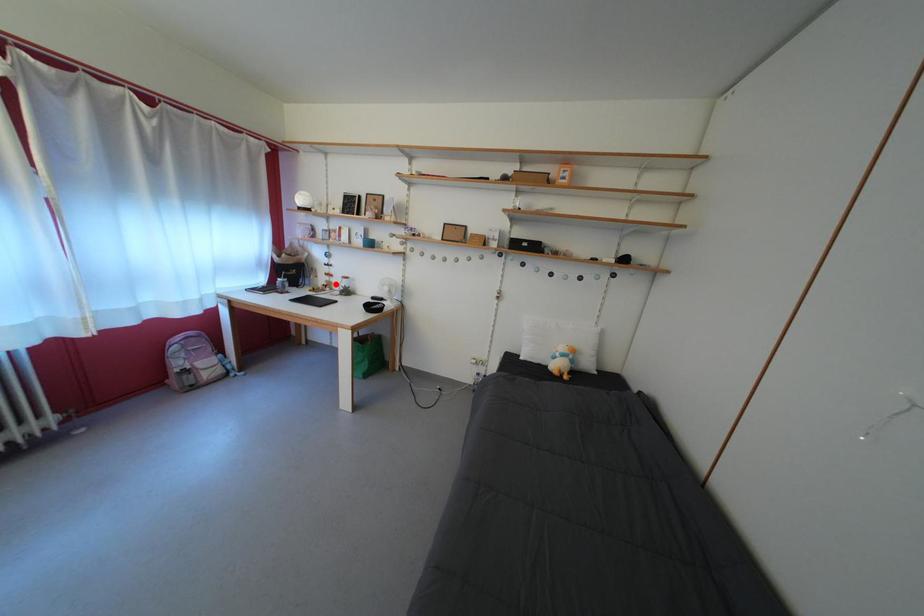
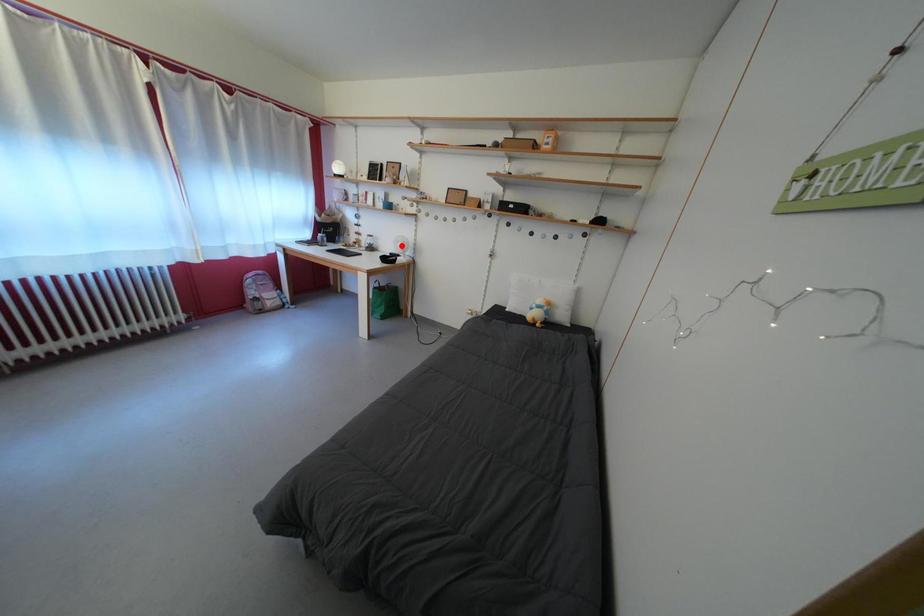
I am providing you with two images of the same scene from different viewpoints. A red point is marked on the first image and another point is marked on the second image. Is the marked point in image1 the same physical position as the marked point in image2?

No